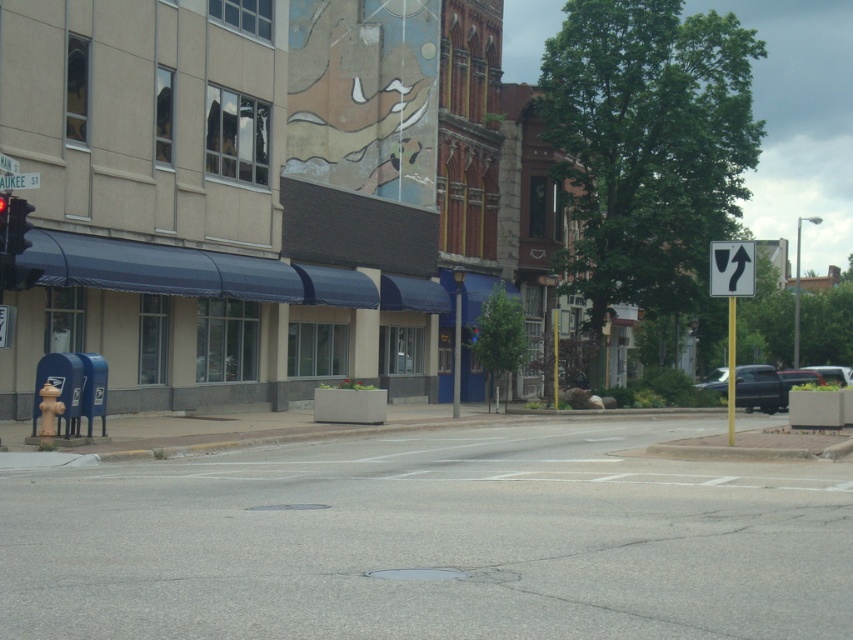
Question: Among these objects, which one is farthest from the camera?

Choices:
 (A) yellow reflective plastic arrow at upper right
 (B) metallic silver car at right
 (C) dark gray metallic car at center-right

Answer: (B)

Question: Which point appears closest to the camera in this image?

Choices:
 (A) (782, 408)
 (B) (7, 209)
 (C) (3, 189)

Answer: (B)

Question: Estimate the real-world distances between objects in this image. Which object is closer to the gray asphalt at center?

Choices:
 (A) metallic silver car at right
 (B) red glass traffic light at left
 (C) metallic silver car at center right
 (D) red glass traffic light at upper center

Answer: (D)

Question: Is red glass traffic light at upper center below white plastic street sign at upper center?

Choices:
 (A) no
 (B) yes

Answer: (B)

Question: Does red glass traffic light at upper center have a larger size compared to red glass traffic light at left?

Choices:
 (A) yes
 (B) no

Answer: (A)

Question: Can you confirm if white plastic street sign at upper center is bigger than red glass traffic light at left?

Choices:
 (A) yes
 (B) no

Answer: (A)